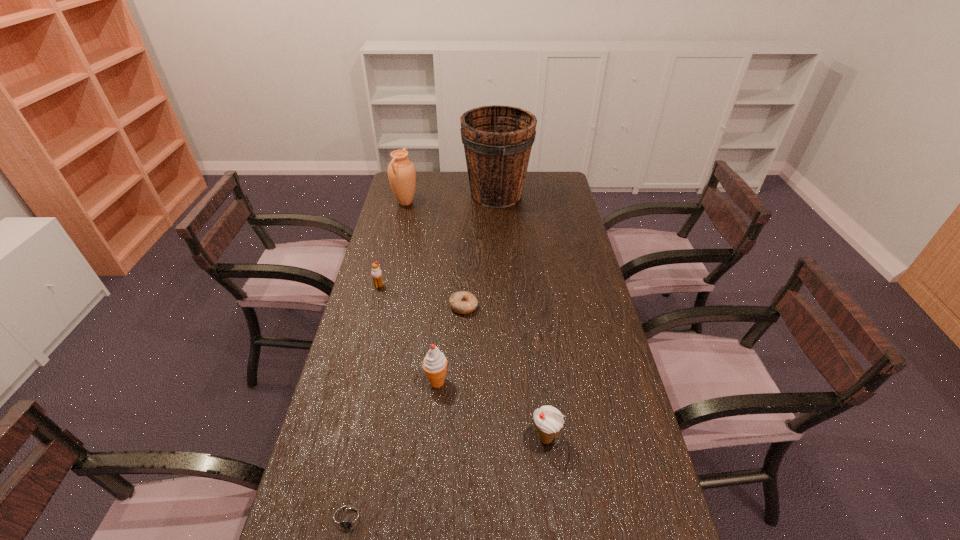
At what (x,y) coordinates should I click in order to perform the action: click on vacant space located 0.190m on the front of the tallest object. Please return your answer as a coordinate pair (x, y). The width and height of the screenshot is (960, 540). Looking at the image, I should click on (498, 238).

You are a GUI agent. You are given a task and a screenshot of the screen. Output one action in this format:
    pyautogui.click(x=<x>, y=<y>)
    Task: Click on the vacant region located 0.080m on the back of the urn
    
    Given the screenshot: What is the action you would take?
    pyautogui.click(x=409, y=186)

This screenshot has width=960, height=540. I want to click on vacant space situated on the right of the third nearest object, so click(496, 381).

I want to click on vacant space located 0.210m on the left of the nearest icecream, so click(x=450, y=438).

At what (x,y) coordinates should I click in order to perform the action: click on free space located at the front with a straw on the third shortest object. Please return your answer as a coordinate pair (x, y). Looking at the image, I should click on (361, 355).

At what (x,y) coordinates should I click in order to perform the action: click on free space located on the back of the second shortest object. Please return your answer as a coordinate pair (x, y). Image resolution: width=960 pixels, height=540 pixels. Looking at the image, I should click on (465, 268).

Where is `bucket that is at the far edge`? The image size is (960, 540). bucket that is at the far edge is located at coordinates (497, 139).

Where is `urn that is at the far edge`? Image resolution: width=960 pixels, height=540 pixels. urn that is at the far edge is located at coordinates (401, 172).

The image size is (960, 540). I want to click on urn located in the left edge section of the desktop, so click(401, 172).

You are a GUI agent. You are given a task and a screenshot of the screen. Output one action in this format:
    pyautogui.click(x=<x>, y=<y>)
    Task: Click on the icecream that is at the left edge
    The width and height of the screenshot is (960, 540).
    Given the screenshot: What is the action you would take?
    pyautogui.click(x=376, y=273)